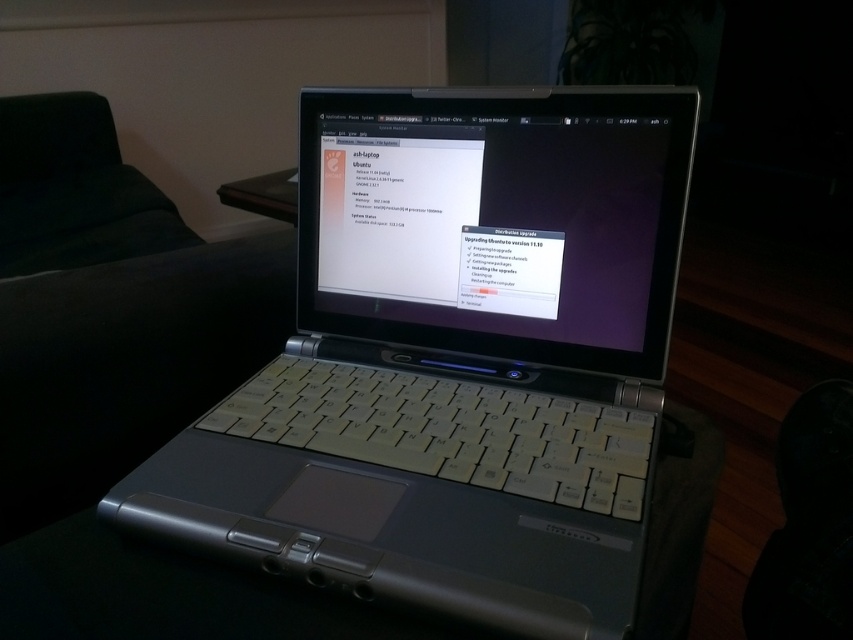
Between silver metallic laptop at center and dark green fabric couch at left, which one has less height?

Standing shorter between the two is silver metallic laptop at center.

Identify the location of silver metallic laptop at center. This screenshot has width=853, height=640. (456, 358).

This screenshot has width=853, height=640. What are the coordinates of `silver metallic laptop at center` in the screenshot? It's located at (456, 358).

Can you confirm if dark green fabric couch at left is thinner than dark green fabric at left?

Yes, dark green fabric couch at left is thinner than dark green fabric at left.

Which of these two, dark green fabric couch at left or dark green fabric at left, stands taller?

Standing taller between the two is dark green fabric at left.

Is point (71, 355) positioned before point (9, 129)?

Yes, it is.

The width and height of the screenshot is (853, 640). Identify the location of dark green fabric couch at left. (109, 308).

Is matte plastic laptop screen at center below black plastic table at center?

Actually, matte plastic laptop screen at center is above black plastic table at center.

Does matte plastic laptop screen at center appear over black plastic table at center?

Yes, matte plastic laptop screen at center is above black plastic table at center.

Where is `matte plastic laptop screen at center`? matte plastic laptop screen at center is located at coordinates (496, 220).